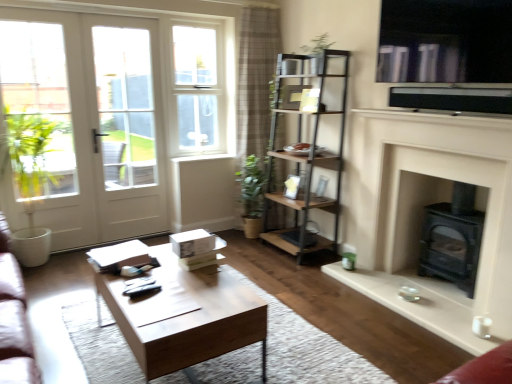
Question: Does point (221, 347) appear closer or farther from the camera than point (325, 167)?

Choices:
 (A) farther
 (B) closer

Answer: (B)

Question: Is wooden coffee table at center bigger or smaller than metallic brown shelf at center?

Choices:
 (A) big
 (B) small

Answer: (B)

Question: Which object is the closest to the white wood window sill at center?

Choices:
 (A) plaid fabric curtain at upper center
 (B) white matte fireplace at right
 (C) white glass screen door at left
 (D) white glass door at left
 (E) white plastic window at upper center

Answer: (E)

Question: Which object is positioned closest to the white plastic window at upper center?

Choices:
 (A) black matte wood burning stove at lower right
 (B) plaid fabric curtain at upper center
 (C) metallic silver window screen at upper right
 (D) wooden coffee table at center
 (E) white wood window sill at center

Answer: (B)